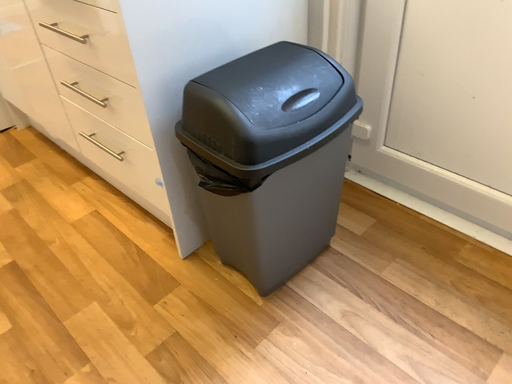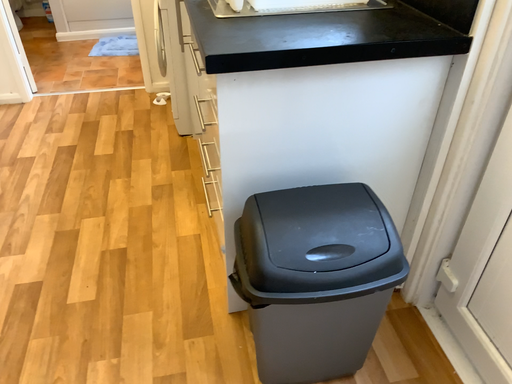
Question: Which way did the camera rotate in the video?

Choices:
 (A) rotated upward
 (B) rotated downward

Answer: (A)